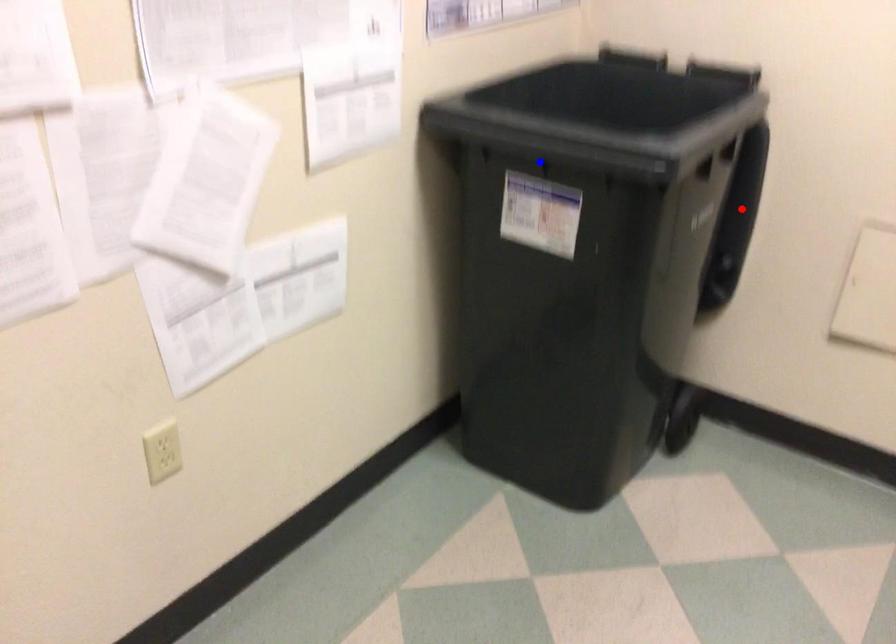
Question: Two points are marked on the image. Which point is closer to the camera?

Choices:
 (A) Blue point is closer.
 (B) Red point is closer.

Answer: (A)